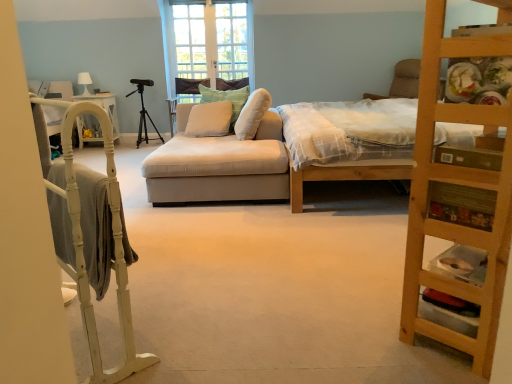
Question: Which direction should I rotate to look at green textured pillow at center, placed as the first pillow when sorted from right to left, — up or down?

Choices:
 (A) down
 (B) up

Answer: (B)

Question: Would you say black matte tripod at center contains beige fabric couch at center?

Choices:
 (A) no
 (B) yes

Answer: (A)

Question: Would you say black matte tripod at center is outside beige fabric couch at center?

Choices:
 (A) yes
 (B) no

Answer: (A)

Question: Is black matte tripod at center turned away from beige fabric couch at center?

Choices:
 (A) yes
 (B) no

Answer: (B)

Question: Does black matte tripod at center have a larger size compared to beige fabric couch at center?

Choices:
 (A) no
 (B) yes

Answer: (A)

Question: Is black matte tripod at center positioned far away from beige fabric couch at center?

Choices:
 (A) yes
 (B) no

Answer: (A)

Question: From the image's perspective, is black matte tripod at center under beige fabric couch at center?

Choices:
 (A) no
 (B) yes

Answer: (A)

Question: From the image's perspective, does beige fabric couch at center appear lower than wooden ladder at right?

Choices:
 (A) no
 (B) yes

Answer: (A)

Question: Is beige fabric couch at center to the right of wooden ladder at right from the viewer's perspective?

Choices:
 (A) yes
 (B) no

Answer: (B)

Question: Can wooden ladder at right be found inside beige fabric couch at center?

Choices:
 (A) yes
 (B) no

Answer: (B)

Question: Can we say beige fabric couch at center lies outside wooden ladder at right?

Choices:
 (A) yes
 (B) no

Answer: (A)

Question: Does beige fabric couch at center have a greater width compared to wooden ladder at right?

Choices:
 (A) yes
 (B) no

Answer: (A)

Question: Is beige fabric couch at center far from wooden ladder at right?

Choices:
 (A) yes
 (B) no

Answer: (A)

Question: Does white glass door at center appear on the right side of wooden bed at center?

Choices:
 (A) no
 (B) yes

Answer: (A)